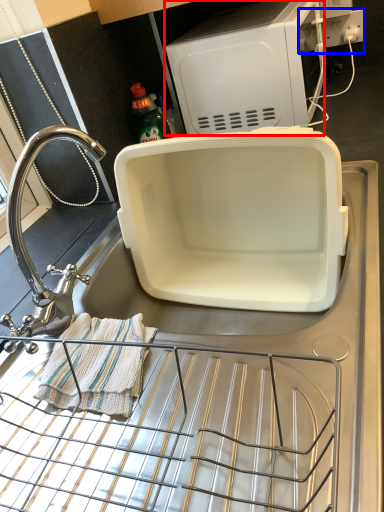
Question: Which object is further to the camera taking this photo, appliance (highlighted by a red box) or electric outlet (highlighted by a blue box)?

Choices:
 (A) appliance
 (B) electric outlet

Answer: (B)